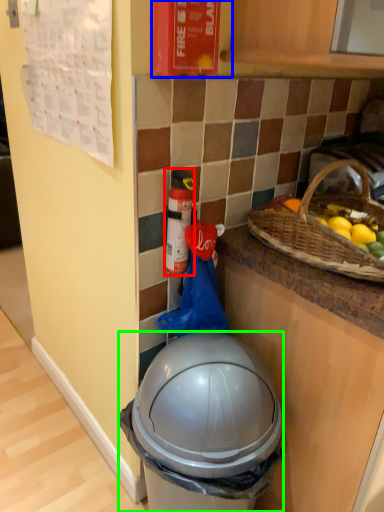
Question: Which object is positioned farthest from bottle (highlighted by a red box)? Select from fire extinguisher (highlighted by a blue box) and trash bin/can (highlighted by a green box).

Choices:
 (A) fire extinguisher
 (B) trash bin/can

Answer: (B)